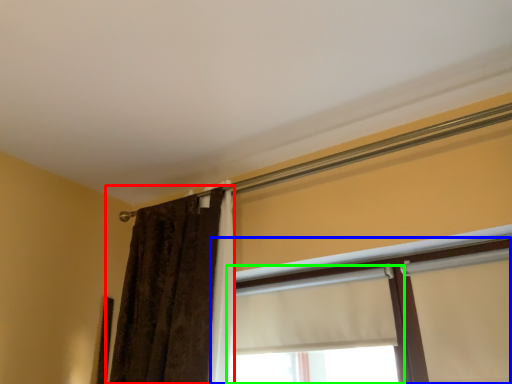
Question: Estimate the real-world distances between objects in this image. Which object is closer to curtain (highlighted by a red box), window (highlighted by a blue box) or window (highlighted by a green box)?

Choices:
 (A) window
 (B) window

Answer: (B)